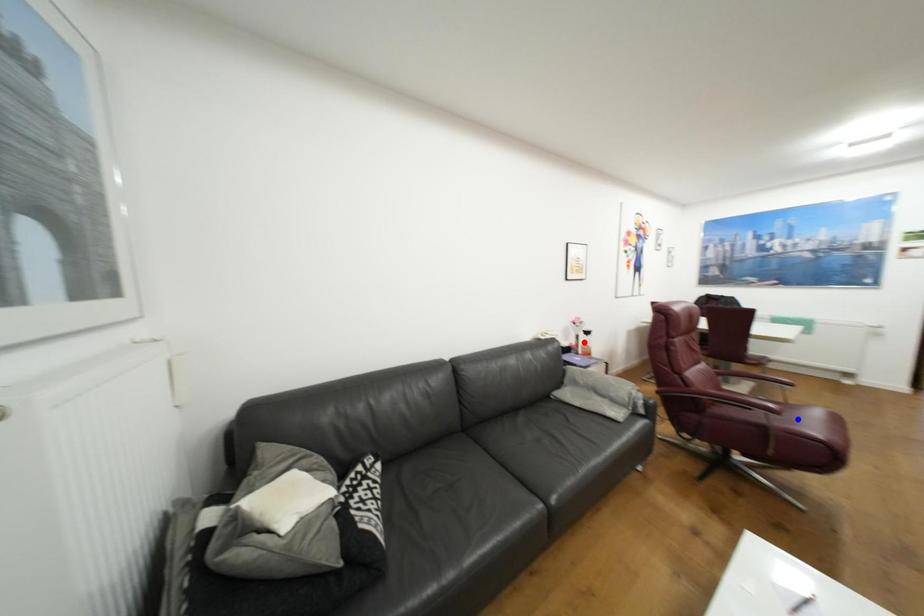
Question: Which of the two points in the image is closer to the camera?

Choices:
 (A) Blue point is closer.
 (B) Red point is closer.

Answer: (A)